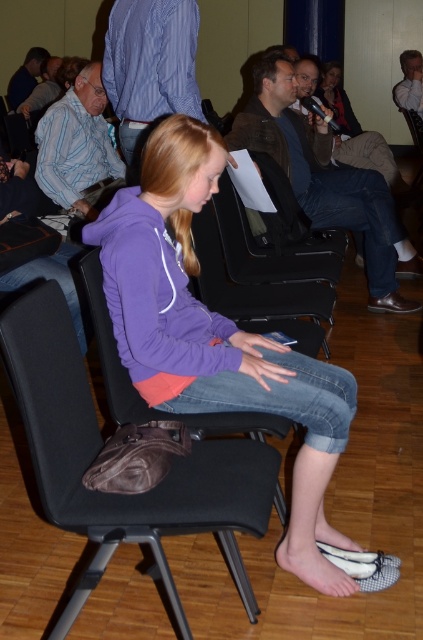
Does point (170, 264) come closer to viewer compared to point (255, 529)?

No, it is behind (255, 529).

The height and width of the screenshot is (640, 423). Find the location of `purple fleece jacket at center`. purple fleece jacket at center is located at coordinates (216, 336).

This screenshot has height=640, width=423. Find the location of `purple fleece jacket at center`. purple fleece jacket at center is located at coordinates point(216,336).